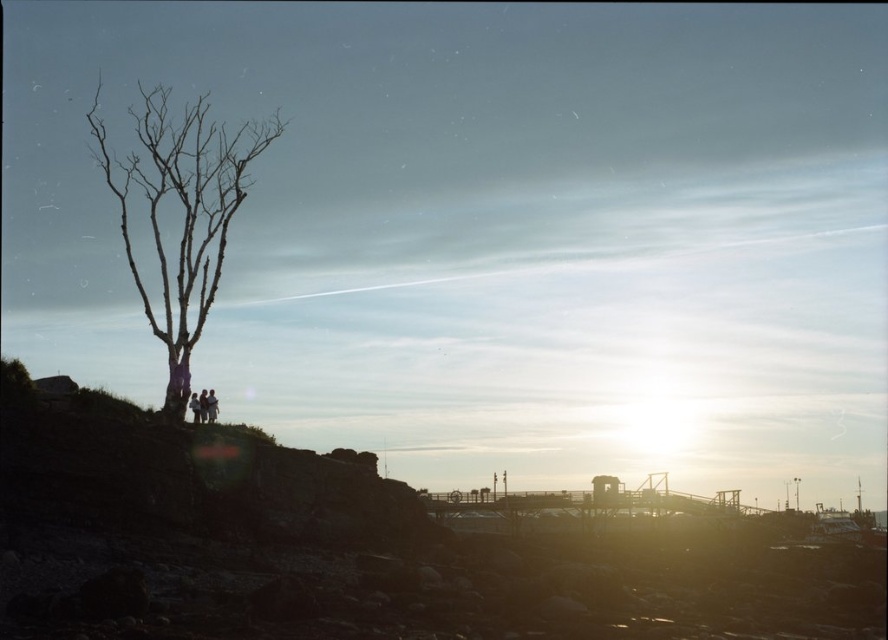
Between point (210, 388) and point (196, 412), which one is positioned behind?

The point (210, 388) is behind.

Who is lower down, dark clothing figure at left or silhouette figure at left?

dark clothing figure at left

Locate an element on the screen. This screenshot has height=640, width=888. dark clothing figure at left is located at coordinates (211, 406).

Can you confirm if dull brown rock at left is bigger than silhouette clothing at left?

Yes, dull brown rock at left is bigger than silhouette clothing at left.

Does dull brown rock at left have a lesser height compared to silhouette clothing at left?

In fact, dull brown rock at left may be taller than silhouette clothing at left.

Which is in front, point (387, 493) or point (202, 392)?

Positioned in front is point (202, 392).

At what (x,y) coordinates should I click in order to perform the action: click on dull brown rock at left. Please return your answer as a coordinate pair (x, y). Looking at the image, I should click on (369, 548).

Who is more forward, (14, 497) or (195, 413)?

Point (14, 497) is in front.

Is dull brown rock at left further to camera compared to silhouette figure at left?

No.

Is point (125, 596) in front of point (196, 417)?

That is True.

In order to click on dull brown rock at left in this screenshot , I will do `click(369, 548)`.